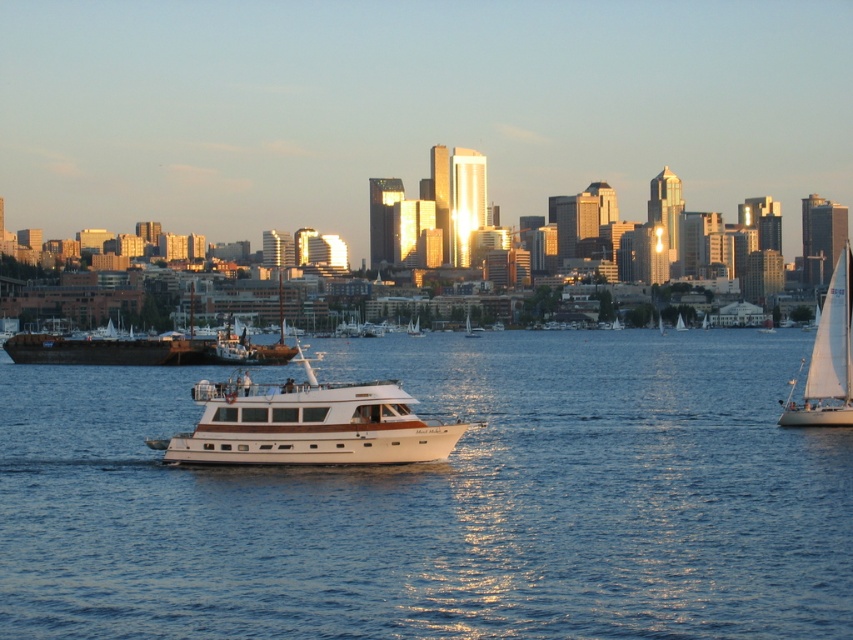
Question: Among these points, which one is farthest from the camera?

Choices:
 (A) (465, 323)
 (B) (253, 353)

Answer: (A)

Question: Does wooden sailboat at center have a greater width compared to white sailboat at center?

Choices:
 (A) yes
 (B) no

Answer: (A)

Question: Considering the relative positions of white glossy boat at center and white sailboat at center in the image provided, where is white glossy boat at center located with respect to white sailboat at center?

Choices:
 (A) below
 (B) above

Answer: (A)

Question: Estimate the real-world distances between objects in this image. Which object is closer to the blue water at center?

Choices:
 (A) wooden sailboat at center
 (B) white sailboat at right
 (C) white sailboat at center

Answer: (B)

Question: Based on their relative distances, which object is farther from the blue water at center?

Choices:
 (A) white sailboat at right
 (B) white polished wood boat at center
 (C) white sailboat at center

Answer: (C)

Question: Does white sailboat at right have a greater width compared to white sailboat at center?

Choices:
 (A) yes
 (B) no

Answer: (A)